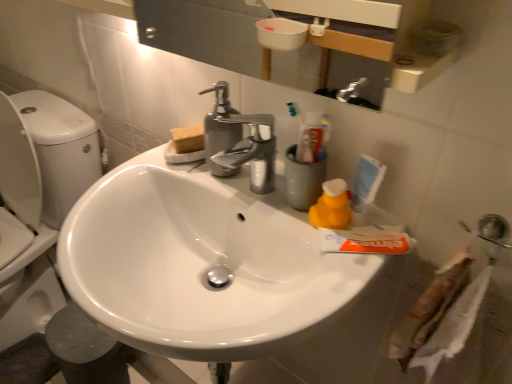
This screenshot has width=512, height=384. I want to click on vacant area that lies between chrome metallic faucet at center and satin nickel faucet at upper center, arranged as the second plumbing fixture when ordered from the bottom, so click(225, 179).